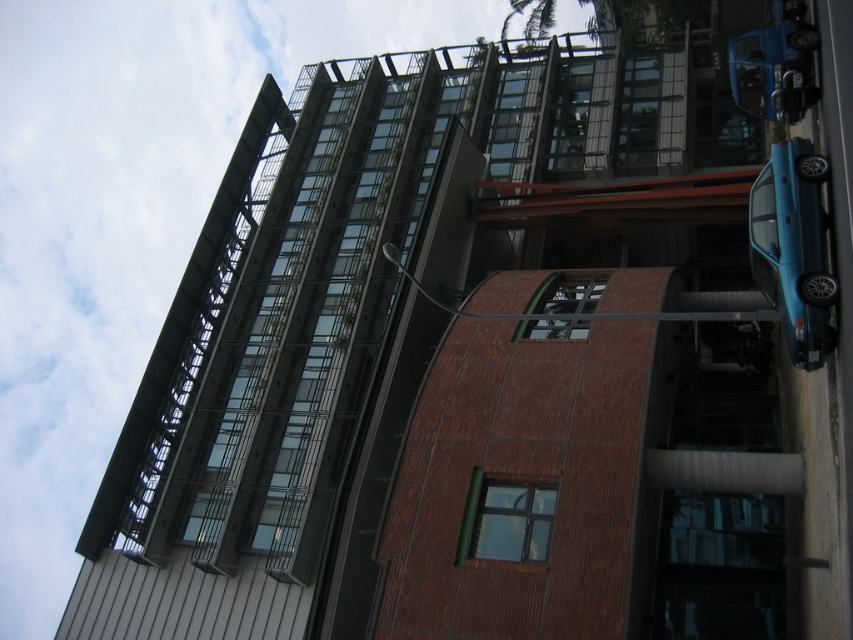
Between teal glossy car at right and blue matte car at upper right, which one has less height?

Standing shorter between the two is blue matte car at upper right.

Does point (772, 232) lie in front of point (775, 81)?

Yes, it is.

Where is `teal glossy car at right`? The image size is (853, 640). teal glossy car at right is located at coordinates (793, 248).